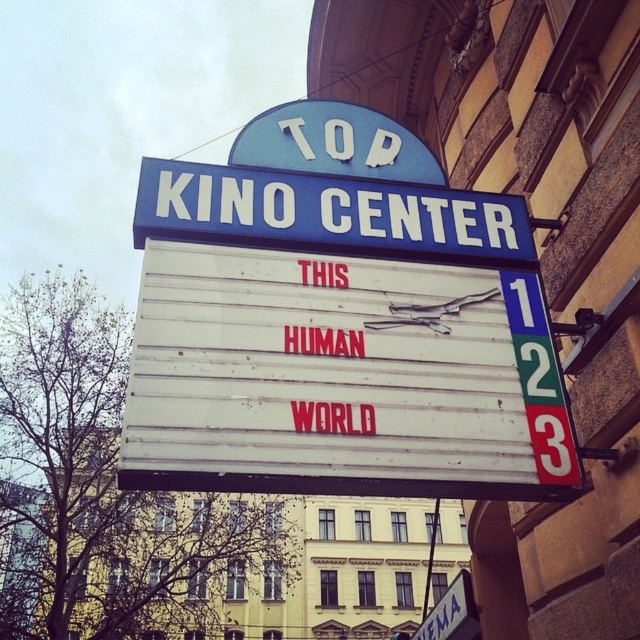
You are standing in front of the Top Kino Center signboard. There is a blue plastic marquee at center located at point (x=330, y=214). Can you tell me what is displayed on the blue plastic marquee at center?

The blue plastic marquee at center at point (x=330, y=214) displays the movie title THIS HUMAN WORLD in red letters.

You are standing in front of the cinema signboard. There are two points marked on the signboard at coordinates point (346,224) and point (474,625). Which point is closer to you?

Point (346,224) is closer to the camera than point (474,625), so the point closer to you is point (346,224).

You are standing in front of the Top Kino Center signboard and want to know the distance to a specific point marked as point (435, 227) on the signboard. Can you estimate how far it is from your current position?

The point (435, 227) is 14.34 meters away from the camera, so the distance is approximately 14.34 meters.